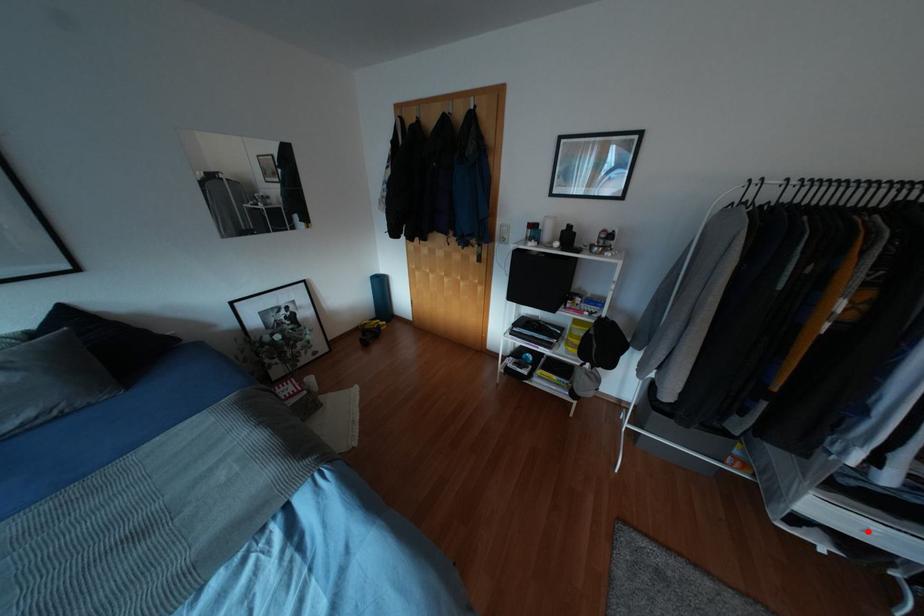
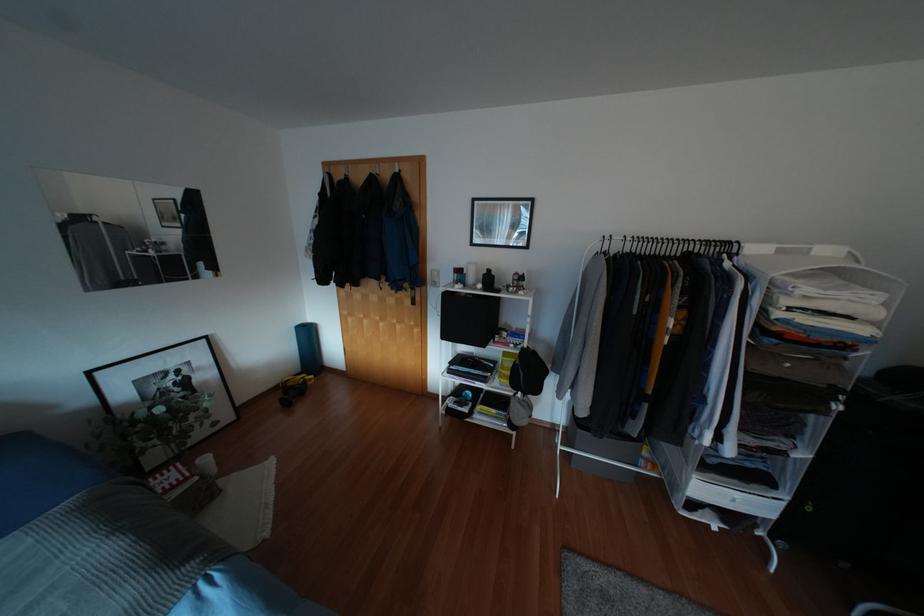
Question: I am providing you with two images of the same scene from different viewpoints. Image1 has a red point marked. In image2, the corresponding 3D location appears at what relative position? Reply with the corresponding letter.

Choices:
 (A) Closer
 (B) Farther

Answer: (A)